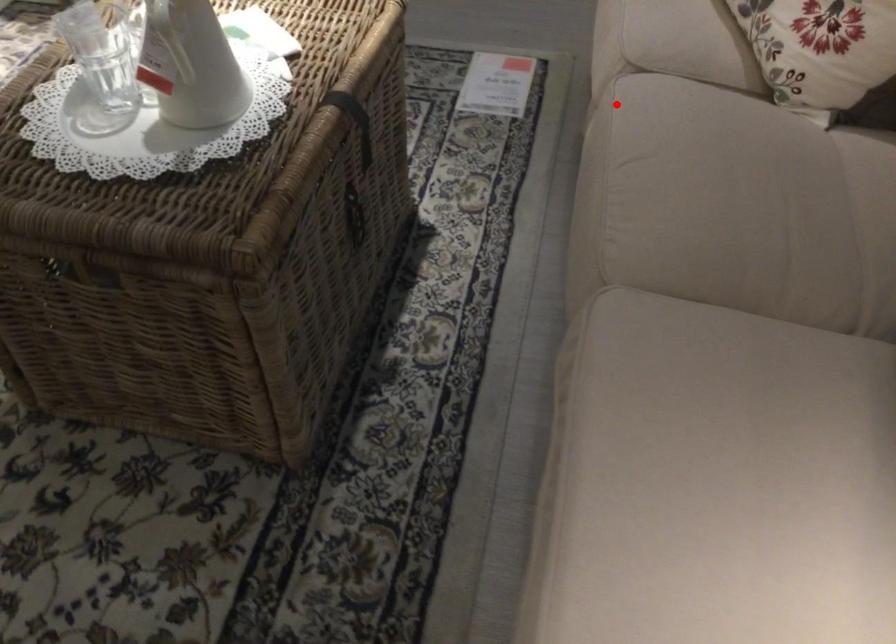
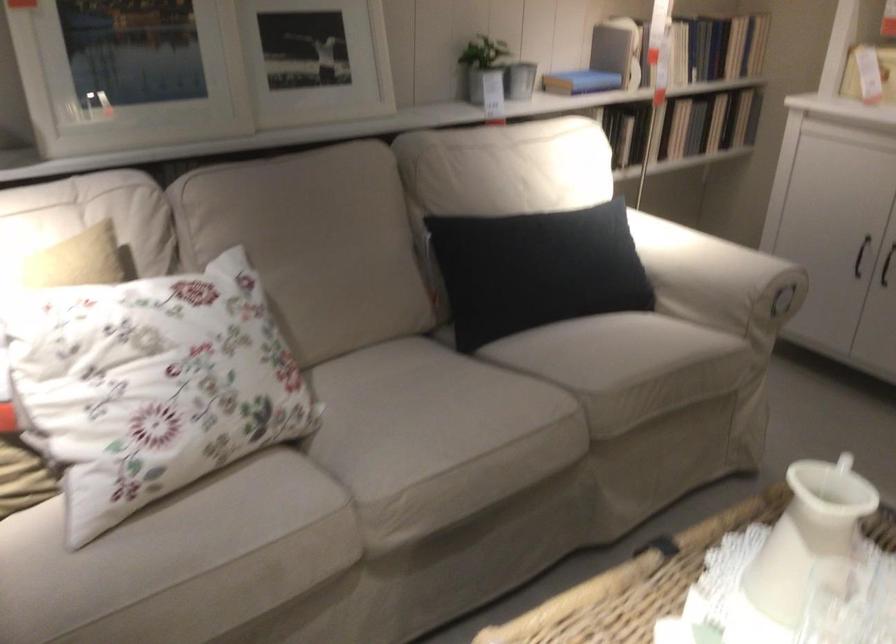
Question: I am providing you with two images of the same scene from different viewpoints. A red point is shown in image1. For the corresponding object point in image2, is it positioned nearer or farther from the camera?

Choices:
 (A) Nearer
 (B) Farther

Answer: (B)